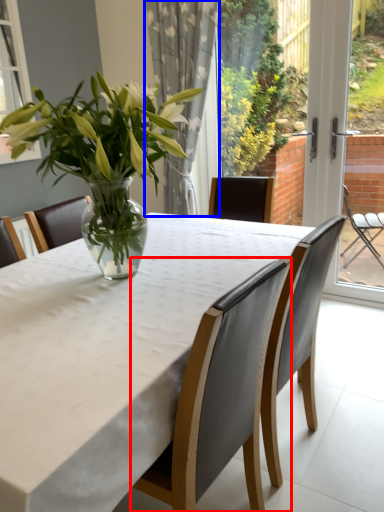
Question: Which point is further to the camera, chair (highlighted by a red box) or curtain (highlighted by a blue box)?

Choices:
 (A) chair
 (B) curtain

Answer: (B)